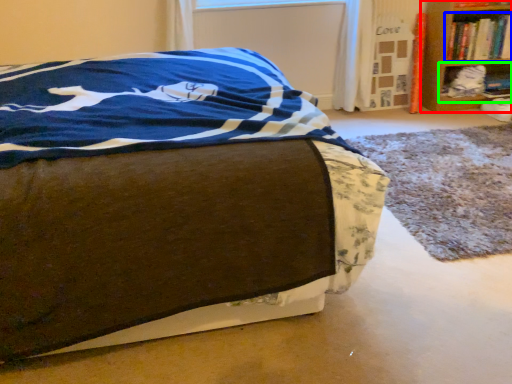
Question: Which object is positioned closest to shelf (highlighted by a red box)? Select from book (highlighted by a blue box) and shelf (highlighted by a green box).

Choices:
 (A) book
 (B) shelf

Answer: (A)